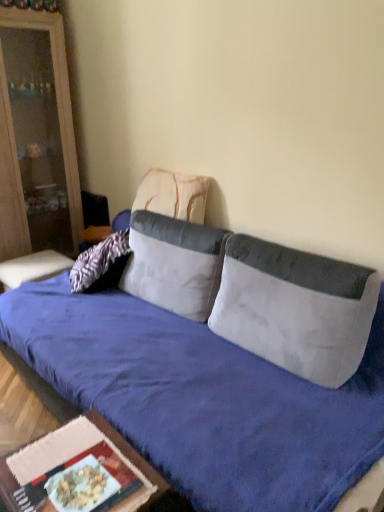
The height and width of the screenshot is (512, 384). I want to click on blank space situated above wooden table at lower left (from a real-world perspective), so click(x=76, y=467).